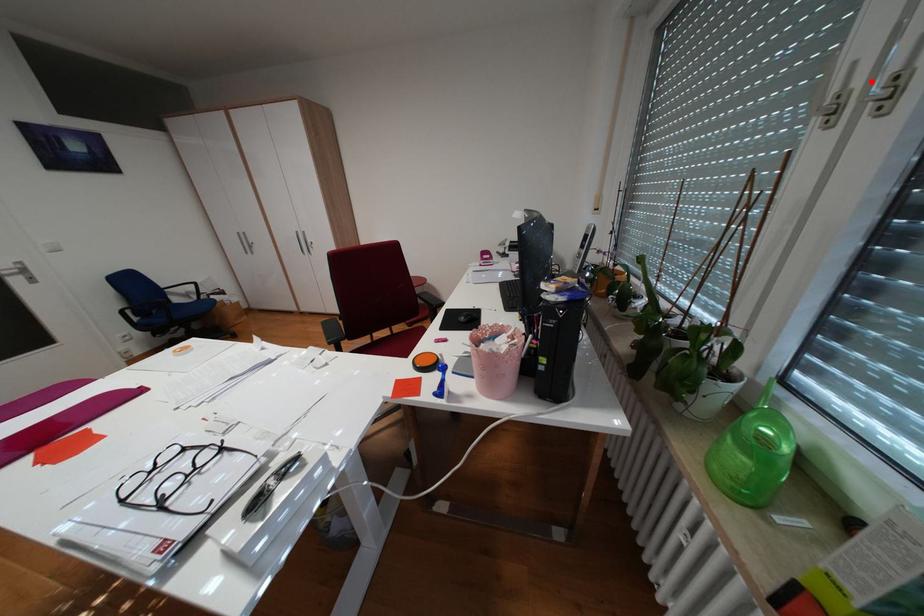
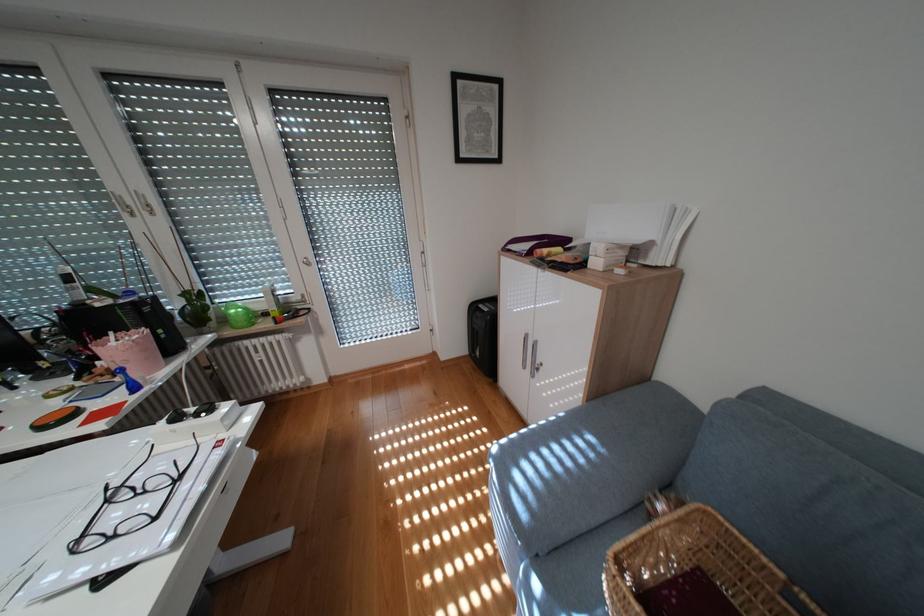
Locate, in the second image, the point that corresponds to the highlighted location in the first image.

(141, 201)